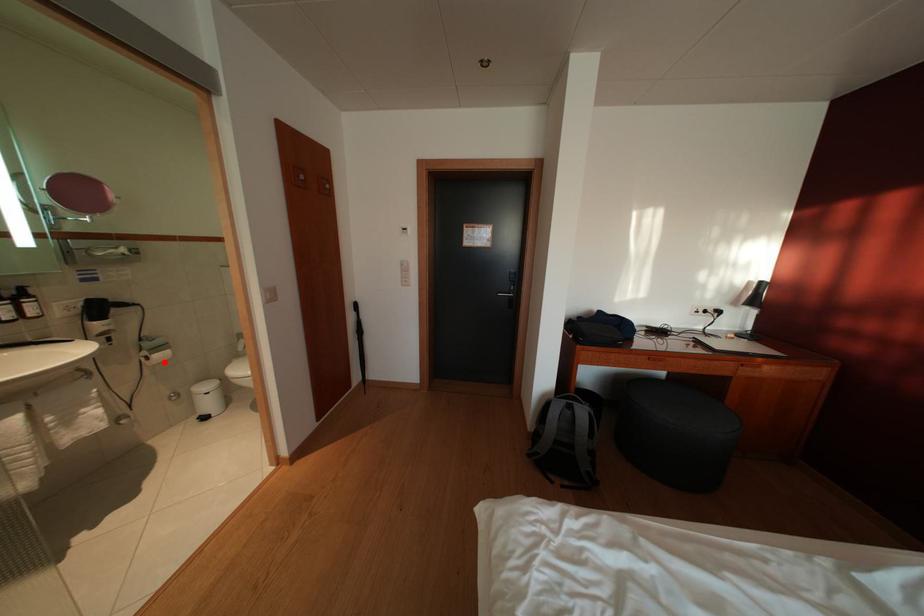
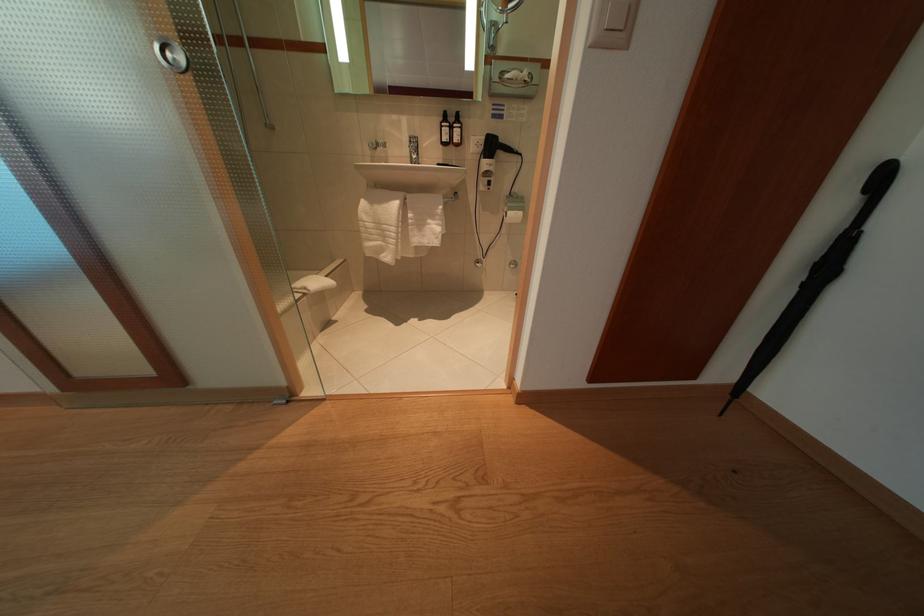
Locate, in the second image, the point that corresponds to the highlighted location in the first image.

(517, 219)